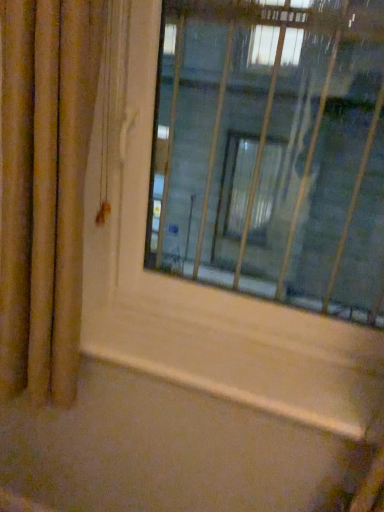
Question: Considering the relative positions of transparent glass window at center and gold textured curtain at left in the image provided, is transparent glass window at center to the right of gold textured curtain at left from the viewer's perspective?

Choices:
 (A) no
 (B) yes

Answer: (B)

Question: Can gold textured curtain at left be found inside transparent glass window at center?

Choices:
 (A) yes
 (B) no

Answer: (B)

Question: Is transparent glass window at center not near gold textured curtain at left?

Choices:
 (A) yes
 (B) no

Answer: (B)

Question: Is transparent glass window at center wider than gold textured curtain at left?

Choices:
 (A) yes
 (B) no

Answer: (B)

Question: Is transparent glass window at center to the left of gold textured curtain at left from the viewer's perspective?

Choices:
 (A) no
 (B) yes

Answer: (A)

Question: Can you confirm if transparent glass window at center is smaller than gold textured curtain at left?

Choices:
 (A) no
 (B) yes

Answer: (A)

Question: Can you confirm if gold textured curtain at left is thinner than transparent glass window at center?

Choices:
 (A) no
 (B) yes

Answer: (A)

Question: From a real-world perspective, is gold textured curtain at left under transparent glass window at center?

Choices:
 (A) no
 (B) yes

Answer: (B)

Question: Is gold textured curtain at left aimed at transparent glass window at center?

Choices:
 (A) no
 (B) yes

Answer: (A)

Question: Is gold textured curtain at left not within transparent glass window at center?

Choices:
 (A) no
 (B) yes

Answer: (B)

Question: Is gold textured curtain at left taller than transparent glass window at center?

Choices:
 (A) yes
 (B) no

Answer: (A)

Question: Considering the relative sizes of gold textured curtain at left and transparent glass window at center in the image provided, is gold textured curtain at left wider than transparent glass window at center?

Choices:
 (A) yes
 (B) no

Answer: (A)

Question: Is wooden at lower center to the right of gold textured curtain at left from the viewer's perspective?

Choices:
 (A) no
 (B) yes

Answer: (B)